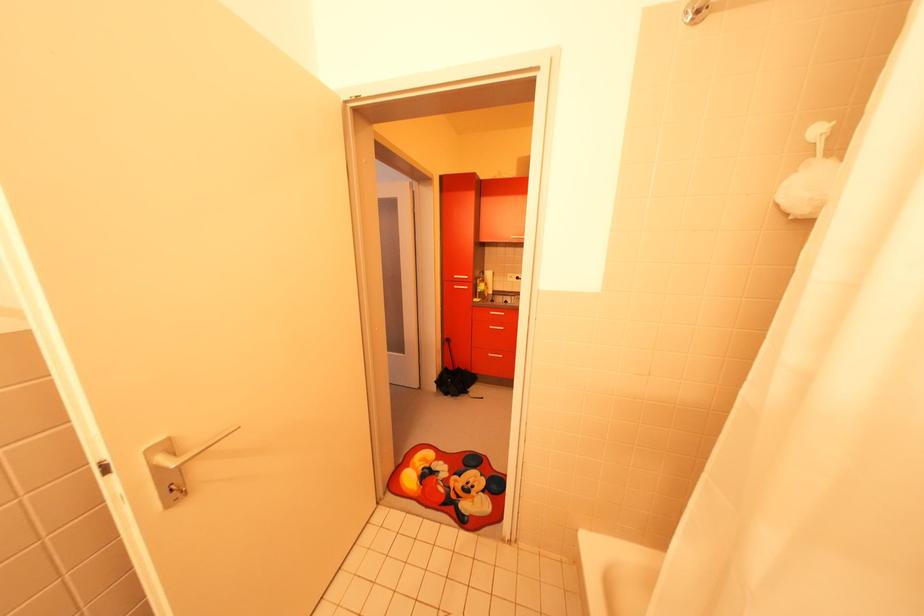
Find the location of a particular element. This screenshot has height=616, width=924. silver drawer handle is located at coordinates click(x=174, y=495).